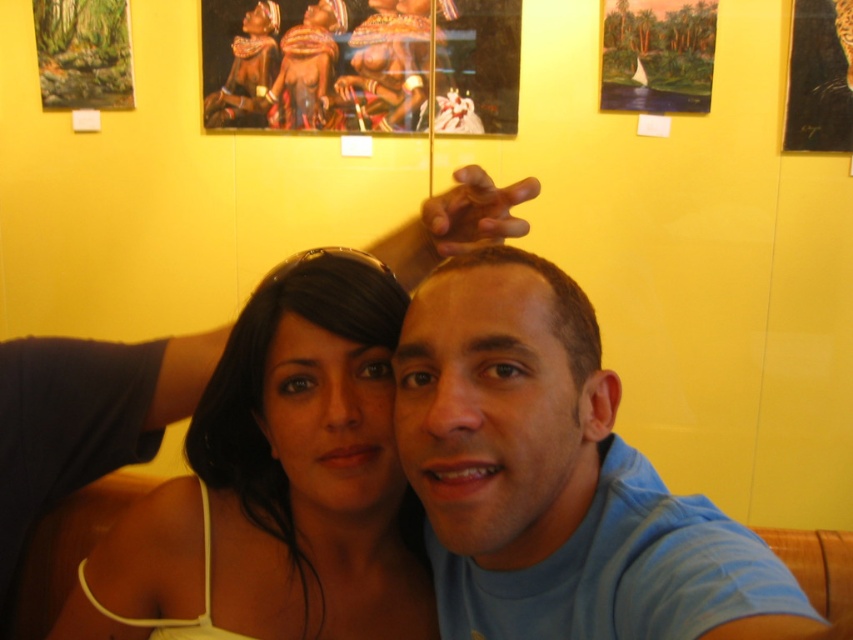
Looking at this image, is matte white tank top at center taller than oil painting landscape at upper center?

Yes, matte white tank top at center is taller than oil painting landscape at upper center.

Is matte white tank top at center further to camera compared to oil painting landscape at upper center?

No, matte white tank top at center is in front of oil painting landscape at upper center.

Identify the location of matte white tank top at center. (277, 484).

Does matte white tank top at center have a greater width compared to matte wooden frame at upper left?

Yes.

Who is shorter, matte white tank top at center or matte wooden frame at upper left?

matte wooden frame at upper left

Who is more forward, (91, 616) or (67, 38)?

Point (91, 616) is in front.

Where is `matte white tank top at center`? The image size is (853, 640). matte white tank top at center is located at coordinates (277, 484).

Can you confirm if blue cotton shirt at center is positioned below matte white tank top at center?

Incorrect, blue cotton shirt at center is not positioned below matte white tank top at center.

Who is taller, blue cotton shirt at center or matte white tank top at center?

matte white tank top at center

Is point (421, 410) farther from camera compared to point (267, 442)?

No, it is in front of (267, 442).

This screenshot has height=640, width=853. In order to click on blue cotton shirt at center in this screenshot , I will do `click(556, 477)`.